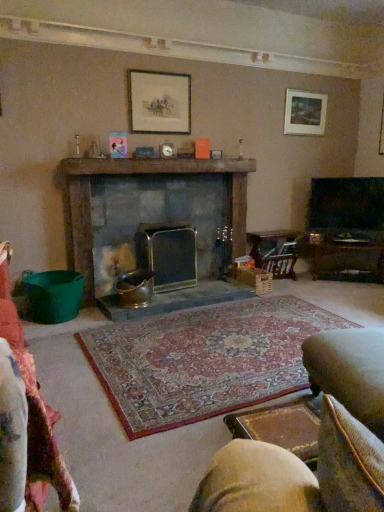
The width and height of the screenshot is (384, 512). In order to click on vacant region under metallic silver fireplace at center, the second fireplace viewed from the left (from a real-world perspective) in this screenshot , I will do `click(177, 286)`.